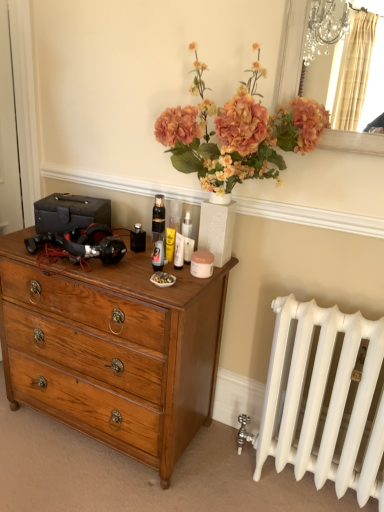
Question: Considering the positions of silver/metallic mirror at upper right and wooden chest of drawers at left in the image, is silver/metallic mirror at upper right wider or thinner than wooden chest of drawers at left?

Choices:
 (A) wide
 (B) thin

Answer: (B)

Question: Considering the relative positions of silver/metallic mirror at upper right and wooden chest of drawers at left in the image provided, is silver/metallic mirror at upper right to the left or to the right of wooden chest of drawers at left?

Choices:
 (A) left
 (B) right

Answer: (B)

Question: Which of these objects is positioned closest to the white glossy lotion at center?

Choices:
 (A) silver/metallic mirror at upper right
 (B) wooden chest of drawers at left

Answer: (B)

Question: Considering the real-world distances, which object is farthest from the wooden chest of drawers at left?

Choices:
 (A) white glossy lotion at center
 (B) silver/metallic mirror at upper right

Answer: (B)